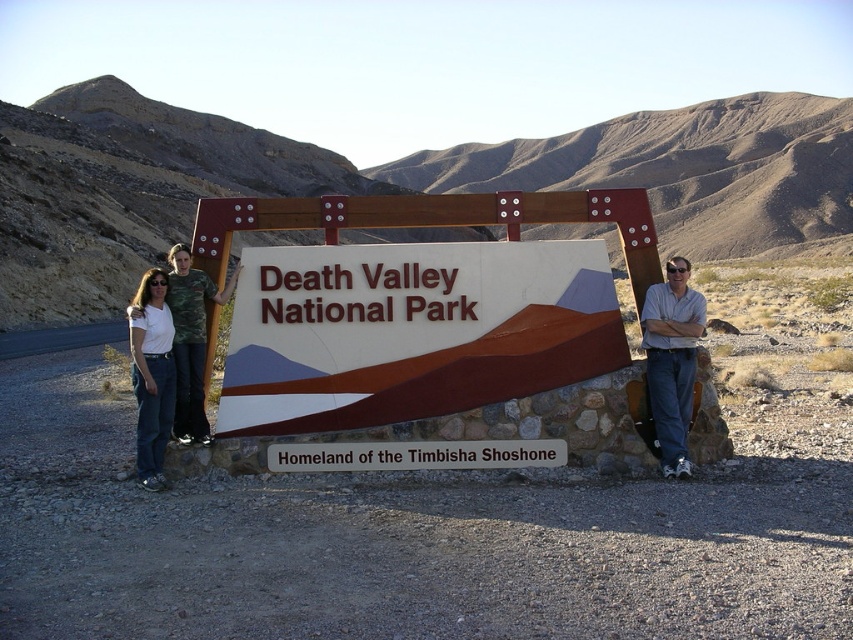
You are a photographer planning to capture a landscape shot of Death Valley National Park. You notice a point at coordinates (672, 360) in the image. What object is located at this point?

The point at coordinates (672, 360) indicates light blue denim jeans at center.